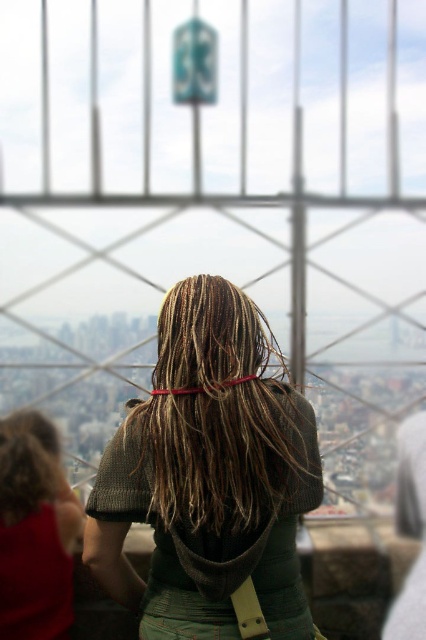
You are a photographer trying to capture a photo of the city from this viewing platform. You notice two points in your frame at coordinates point (275, 385) and point (55, 481). Which point is closer to your camera lens?

Point (275, 385) is closer to the camera than point (55, 481).